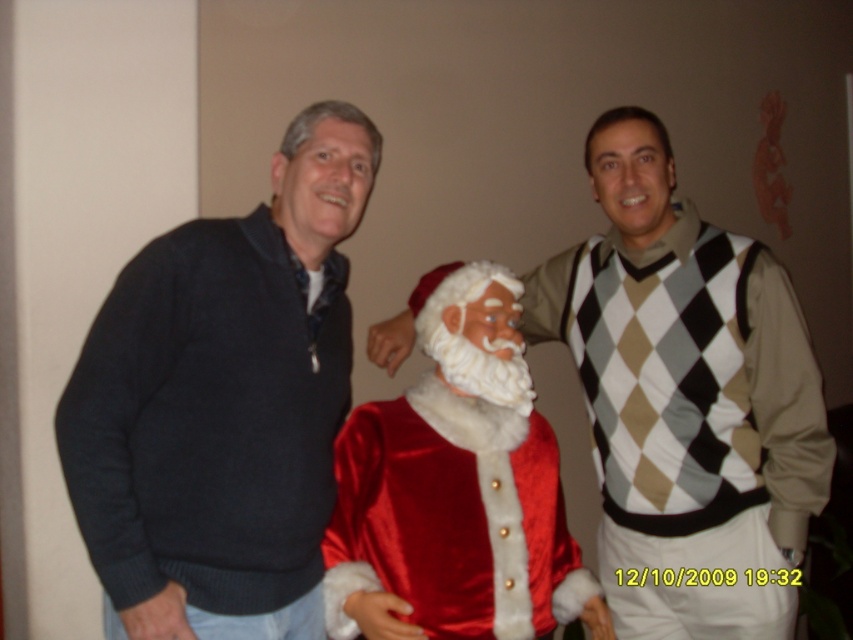
You are standing at the point labeled point (715, 298) and want to walk towards the door located at point (358, 561). Will you need to move forward or backward to reach the door?

Since point (715, 298) is behind point (358, 561), you will need to move forward to reach the door located at point (358, 561).

You are trying to determine the spatial relationship between the dark gray sweater at left and the satin santa at center. Which object is covering part of the other?

The dark gray sweater at left is positioned over the satin santa at center, meaning it is covering part of the satin santa at center.

From the picture: You are standing in the room and want to place a small gift box exactly where the dark gray sweater at left is located. What are the coordinates where you should place it?

The coordinates for the dark gray sweater at left are at point (223, 403), so you should place the small gift box there.